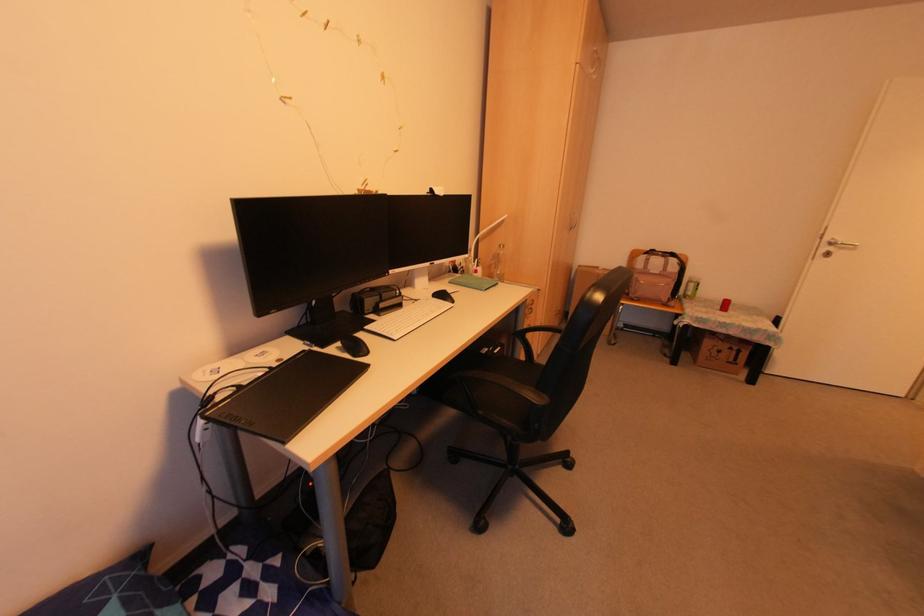
Where is `chair sitting surface`? chair sitting surface is located at coordinates (487, 383).